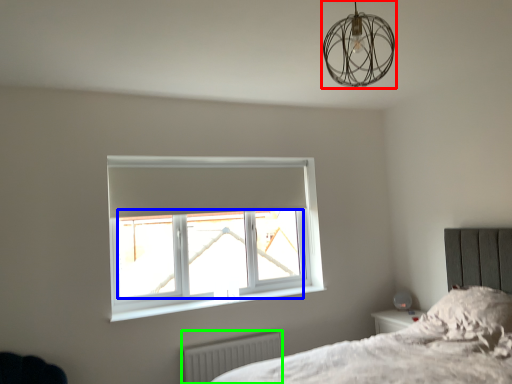
Question: Based on their relative distances, which object is farther from lamp (highlighted by a red box)? Choose from window screen (highlighted by a blue box) and radiator (highlighted by a green box).

Choices:
 (A) window screen
 (B) radiator

Answer: (B)